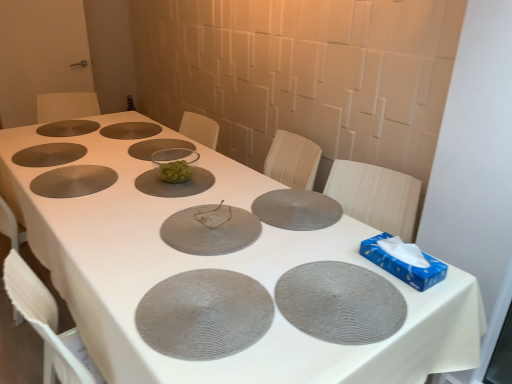
Find the location of a particular element. vacant space situated on the left part of clear glass bowl at center, acting as the 5th glass plate starting from the back is located at coordinates (101, 176).